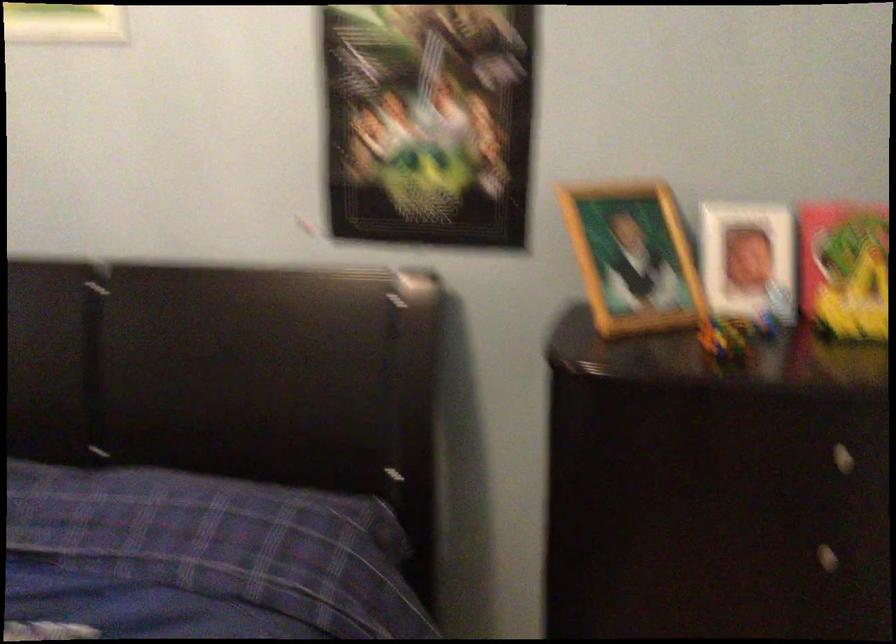
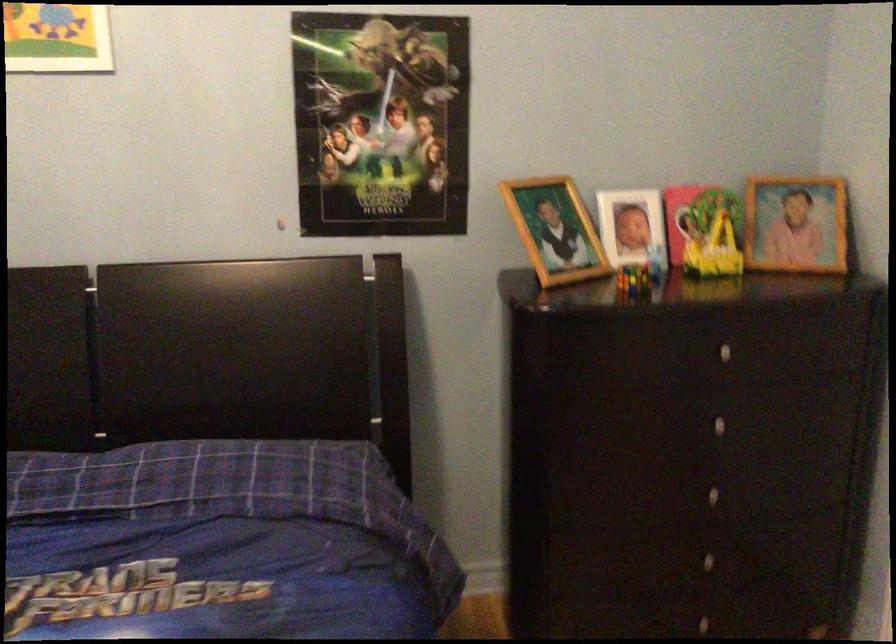
Where in the second image is the point corresponding to (631,258) from the first image?

(555, 230)